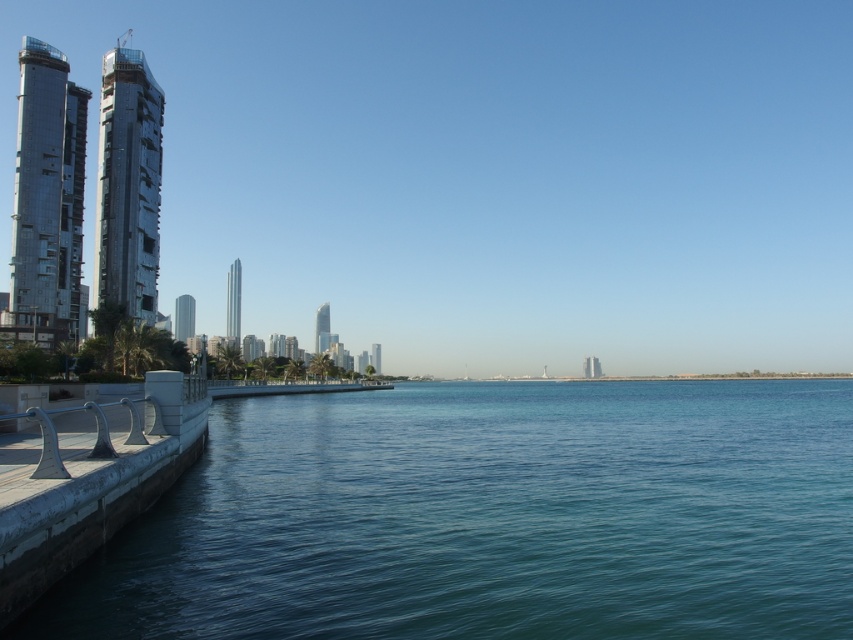
You are a delivery drone that needs to land on the white concrete dock at lower left. Your landing pad is 100 feet away from the clear blue water at lower left. Can you safely land on the dock?

The clear blue water at lower left and white concrete dock at lower left are 98.26 feet apart from each other. Since the distance between them is less than 100 feet, the drone can safely land on the white concrete dock at lower left.

You are standing at the point closer to the camera between the two points, point (759, 400) and point (154, 451). Which point are you standing at?

You are standing at point (759, 400) because it is further to the camera than point (154, 451).